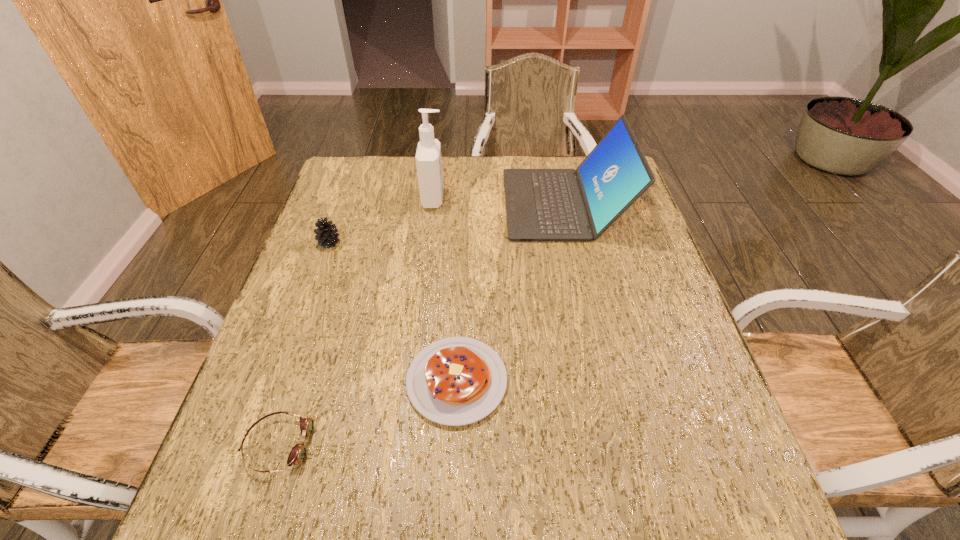
Where is `free space between the pancake and the cleansing agent`? Image resolution: width=960 pixels, height=540 pixels. free space between the pancake and the cleansing agent is located at coordinates (445, 290).

Image resolution: width=960 pixels, height=540 pixels. In order to click on empty space between the tallest object and the goggles in this screenshot , I will do `click(356, 322)`.

You are a GUI agent. You are given a task and a screenshot of the screen. Output one action in this format:
    pyautogui.click(x=<x>, y=<y>)
    Task: Click on the unoccupied position between the shortest object and the tallest object
    
    Given the screenshot: What is the action you would take?
    pyautogui.click(x=356, y=322)

At what (x,y) coordinates should I click in order to perform the action: click on vacant space in between the pancake and the second tallest object. Please return your answer as a coordinate pair (x, y). The width and height of the screenshot is (960, 540). Looking at the image, I should click on (511, 292).

Where is `free spot between the tallest object and the laptop computer`? The width and height of the screenshot is (960, 540). free spot between the tallest object and the laptop computer is located at coordinates (499, 201).

I want to click on object that is the third closest to the pancake, so click(326, 234).

Find the location of a particular element. The height and width of the screenshot is (540, 960). object that can be found as the second closest to the rightmost object is located at coordinates (454, 381).

You are a GUI agent. You are given a task and a screenshot of the screen. Output one action in this format:
    pyautogui.click(x=<x>, y=<y>)
    Task: Click on the vacant region that satisfies the following two spatial constraints: 1. on the front label of the tallest object; 2. on the back side of the pancake
    The width and height of the screenshot is (960, 540).
    Given the screenshot: What is the action you would take?
    pyautogui.click(x=412, y=381)

The height and width of the screenshot is (540, 960). I want to click on free point that satisfies the following two spatial constraints: 1. on the back side of the pancake; 2. on the front label of the tallest object, so click(x=465, y=199).

Identify the location of vacant region that satisfies the following two spatial constraints: 1. on the front label of the pancake; 2. on the left side of the tallest object. The height and width of the screenshot is (540, 960). (412, 381).